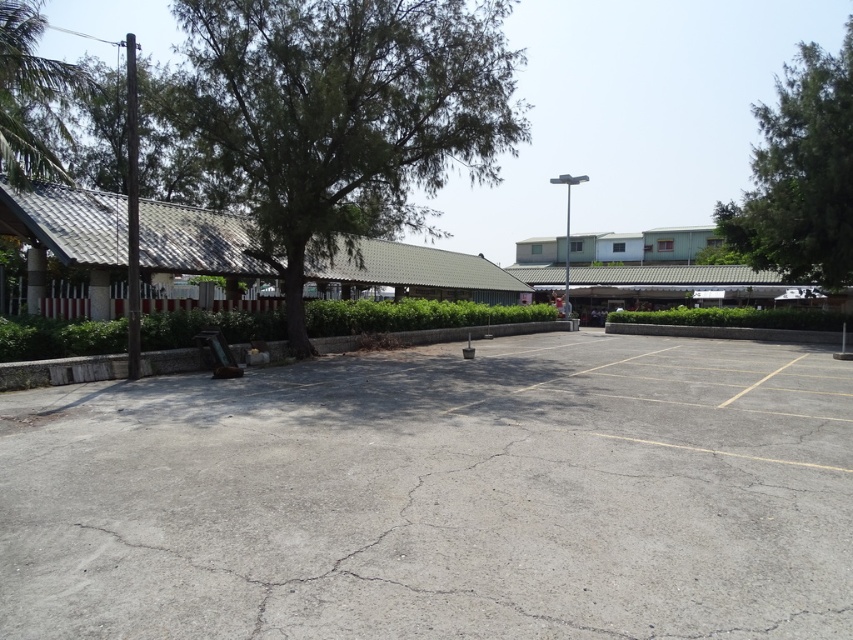
Question: Based on their relative distances, which object is farther from the gray asphalt parking lot at center?

Choices:
 (A) green leafy tree at center
 (B) green leafy tree at upper left
 (C) green leafy tree at upper right

Answer: (C)

Question: Based on their relative distances, which object is nearer to the green leafy tree at center?

Choices:
 (A) green leafy tree at upper right
 (B) green leafy tree at upper left

Answer: (B)

Question: Is gray asphalt parking lot at center below green leafy tree at center?

Choices:
 (A) yes
 (B) no

Answer: (A)

Question: Which of the following is the farthest from the observer?

Choices:
 (A) (807, 136)
 (B) (48, 448)

Answer: (A)

Question: Is green leafy tree at upper right to the left of green leafy tree at upper left from the viewer's perspective?

Choices:
 (A) yes
 (B) no

Answer: (B)

Question: Can you confirm if green leafy tree at center is wider than green leafy tree at upper left?

Choices:
 (A) yes
 (B) no

Answer: (A)